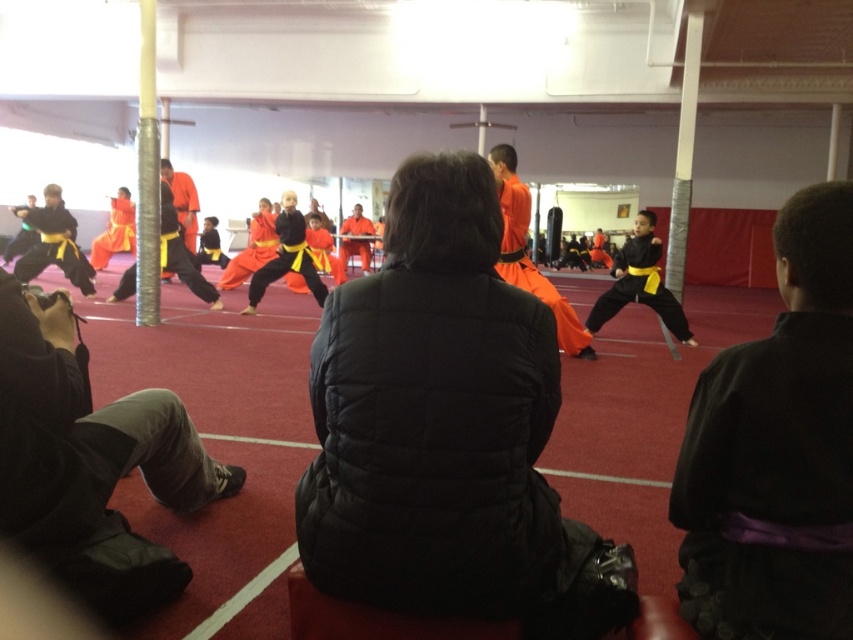
Question: Based on their relative distances, which object is nearer to the matte orange martial arts uniform at center?

Choices:
 (A) matte black martial arts uniform at left
 (B) black quilted jacket at center
 (C) orange fabric pants at center

Answer: (B)

Question: In this image, where is matte orange martial arts uniform at center located relative to orange fabric pants at center?

Choices:
 (A) left
 (B) right

Answer: (B)

Question: Which is nearer to the matte black martial arts uniform at center?

Choices:
 (A) purple satin belt at right
 (B) matte orange martial arts uniform at center
 (C) matte black martial arts uniform at left

Answer: (C)

Question: Which object appears farthest from the camera in this image?

Choices:
 (A) matte black martial arts uniform at left
 (B) matte orange martial arts uniform at center
 (C) purple satin belt at right

Answer: (A)

Question: Does black quilted jacket at center have a larger size compared to matte orange martial arts uniform at center?

Choices:
 (A) no
 (B) yes

Answer: (A)

Question: Can you confirm if purple satin belt at right is bigger than matte orange martial arts uniform at center?

Choices:
 (A) yes
 (B) no

Answer: (B)